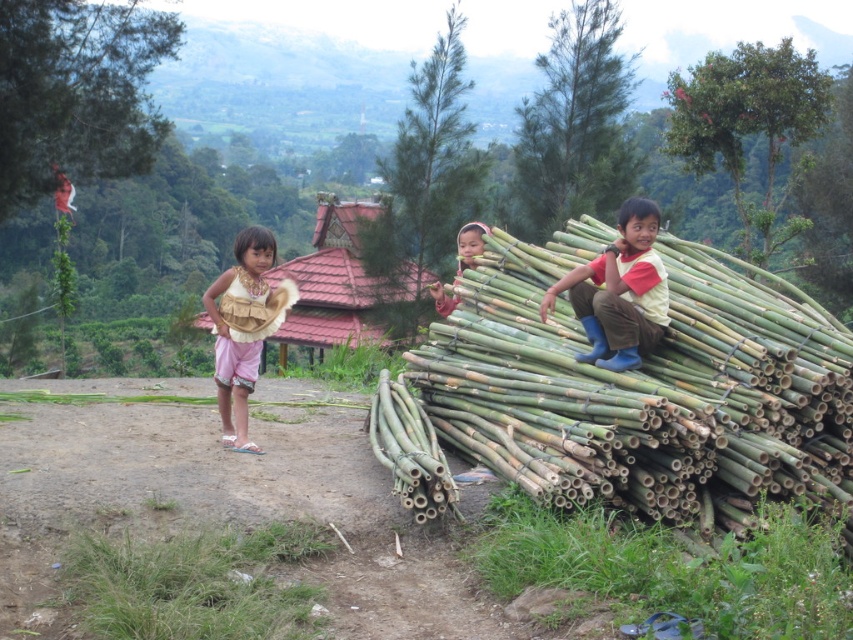
Can you confirm if pink satin dress at left is positioned above smooth bamboo stick at center?

No, pink satin dress at left is not above smooth bamboo stick at center.

Is point (202, 301) positioned before point (436, 294)?

No.

Where is `pink satin dress at left`? This screenshot has width=853, height=640. pink satin dress at left is located at coordinates (242, 326).

This screenshot has height=640, width=853. Describe the element at coordinates (645, 387) in the screenshot. I see `green bamboo logs at right` at that location.

Can you confirm if green bamboo logs at right is positioned below matte yellow shirt at right?

Indeed, green bamboo logs at right is positioned under matte yellow shirt at right.

Find the location of `green bamboo logs at right`. green bamboo logs at right is located at coordinates pos(645,387).

Where is `green bamboo logs at right`? This screenshot has height=640, width=853. green bamboo logs at right is located at coordinates (645, 387).

Is green bamboo logs at right further to camera compared to smooth bamboo stick at center?

That is False.

Image resolution: width=853 pixels, height=640 pixels. What do you see at coordinates (645, 387) in the screenshot?
I see `green bamboo logs at right` at bounding box center [645, 387].

You are a GUI agent. You are given a task and a screenshot of the screen. Output one action in this format:
    pyautogui.click(x=<x>, y=<y>)
    Task: Click on the green bamboo logs at right
    
    Given the screenshot: What is the action you would take?
    pyautogui.click(x=645, y=387)